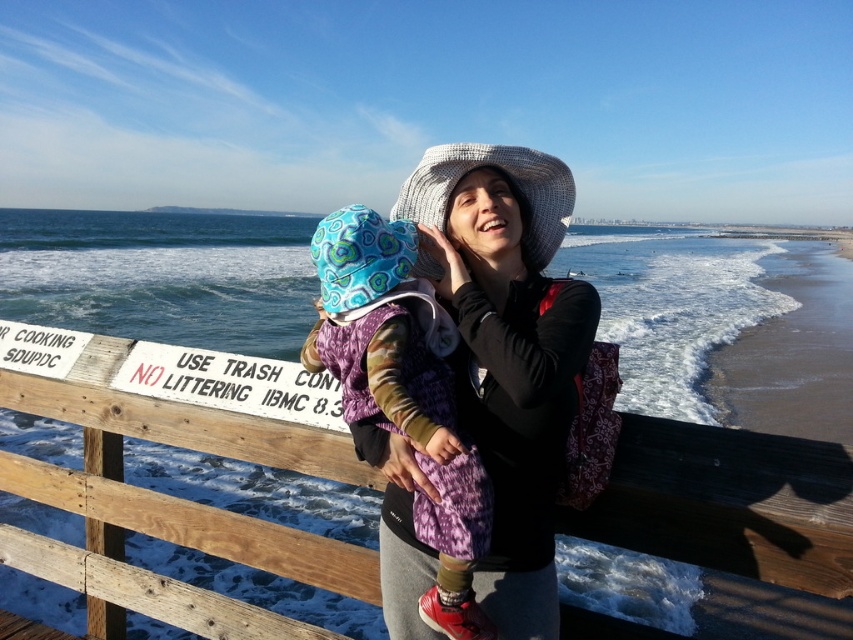
Can you confirm if wooden at center is positioned to the right of knitted wool hat at center?

No, wooden at center is not to the right of knitted wool hat at center.

Is point (349, 472) behind point (404, 608)?

Yes, point (349, 472) is behind point (404, 608).

Where is `wooden at center`? The height and width of the screenshot is (640, 853). wooden at center is located at coordinates (171, 496).

Who is more forward, (531, 202) or (334, 236)?

Point (334, 236) is in front.

Between knitted wool hat at center and printed fabric baby at center, which one is positioned lower?

printed fabric baby at center is lower down.

Between point (512, 401) and point (444, 348), which one is positioned behind?

Positioned behind is point (444, 348).

The height and width of the screenshot is (640, 853). I want to click on knitted wool hat at center, so pyautogui.click(x=508, y=349).

In the scene shown: Does knitted wool hat at center have a lesser height compared to sandy beach at lower right?

Indeed, knitted wool hat at center has a lesser height compared to sandy beach at lower right.

Image resolution: width=853 pixels, height=640 pixels. What do you see at coordinates (508, 349) in the screenshot?
I see `knitted wool hat at center` at bounding box center [508, 349].

Image resolution: width=853 pixels, height=640 pixels. What do you see at coordinates (508, 349) in the screenshot?
I see `knitted wool hat at center` at bounding box center [508, 349].

The image size is (853, 640). What are the coordinates of `knitted wool hat at center` in the screenshot? It's located at (508, 349).